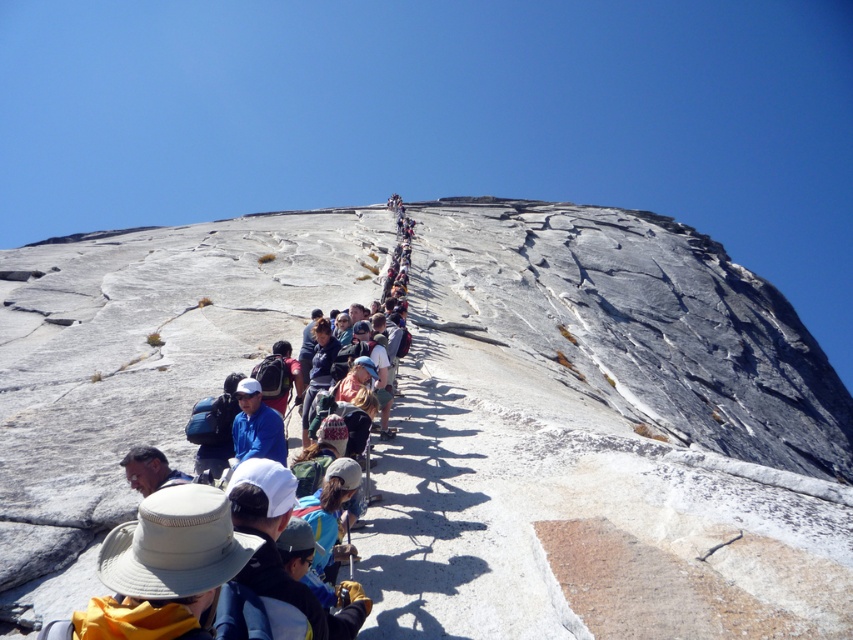
You are a hiker looking at the gray rock formation at center and the light brown leather hat at center. Which object is closer to you?

The gray rock formation at center is closer to you because it is in front of the light brown leather hat at center.